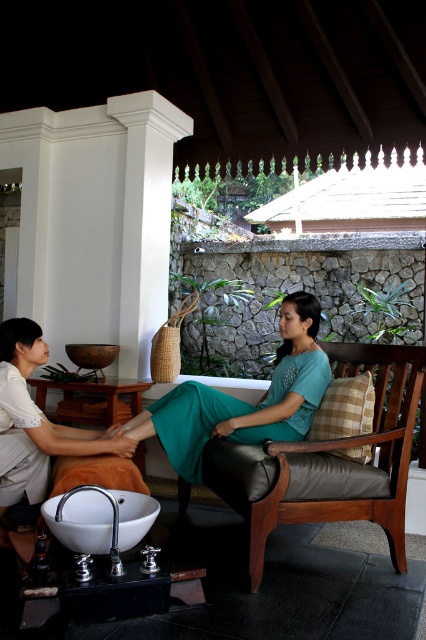
Can you confirm if leather cushioned chair at center is taller than teal matte dress at center?

No, leather cushioned chair at center is not taller than teal matte dress at center.

Between point (333, 516) and point (301, 340), which one is positioned in front?

Point (333, 516) is more forward.

Where is `leather cushioned chair at center`? The image size is (426, 640). leather cushioned chair at center is located at coordinates (328, 461).